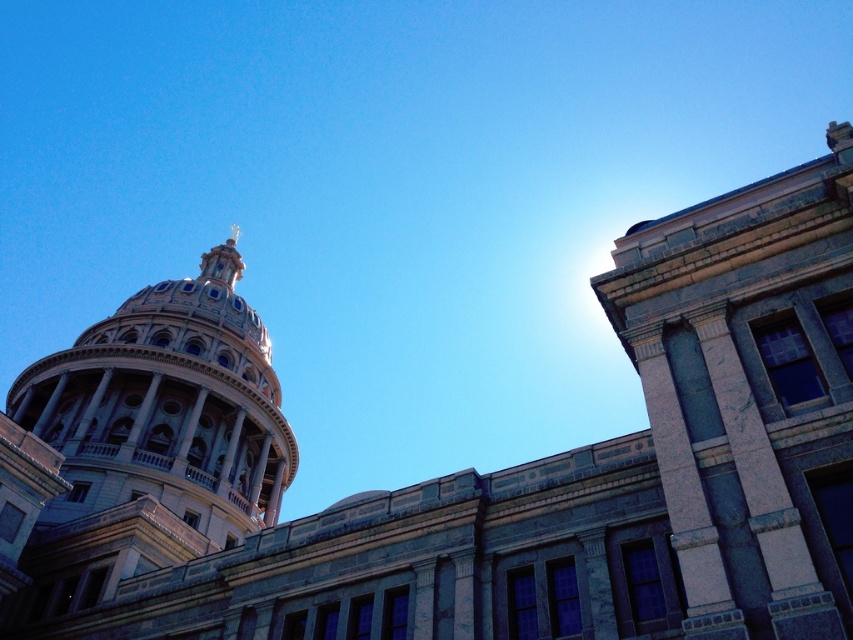
Question: Which of the following is the farthest from the observer?

Choices:
 (A) gray stone building at upper right
 (B) gold metallic spire at upper center
 (C) marble dome at upper left

Answer: (B)

Question: Can you confirm if marble dome at upper left is wider than gold metallic spire at upper center?

Choices:
 (A) yes
 (B) no

Answer: (A)

Question: Does gray stone building at upper right appear over marble dome at upper left?

Choices:
 (A) no
 (B) yes

Answer: (B)

Question: Which object is the closest to the gold metallic spire at upper center?

Choices:
 (A) gray stone building at upper right
 (B) marble dome at upper left

Answer: (B)

Question: Does gray stone building at upper right have a larger size compared to gold metallic spire at upper center?

Choices:
 (A) yes
 (B) no

Answer: (B)

Question: Which of these objects is positioned farthest from the gray stone building at upper right?

Choices:
 (A) gold metallic spire at upper center
 (B) marble dome at upper left

Answer: (A)